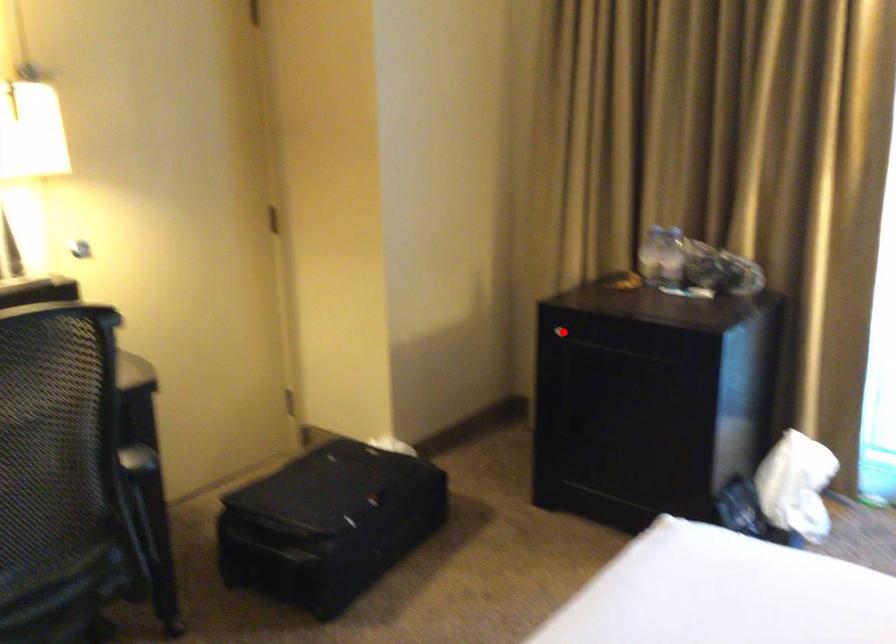
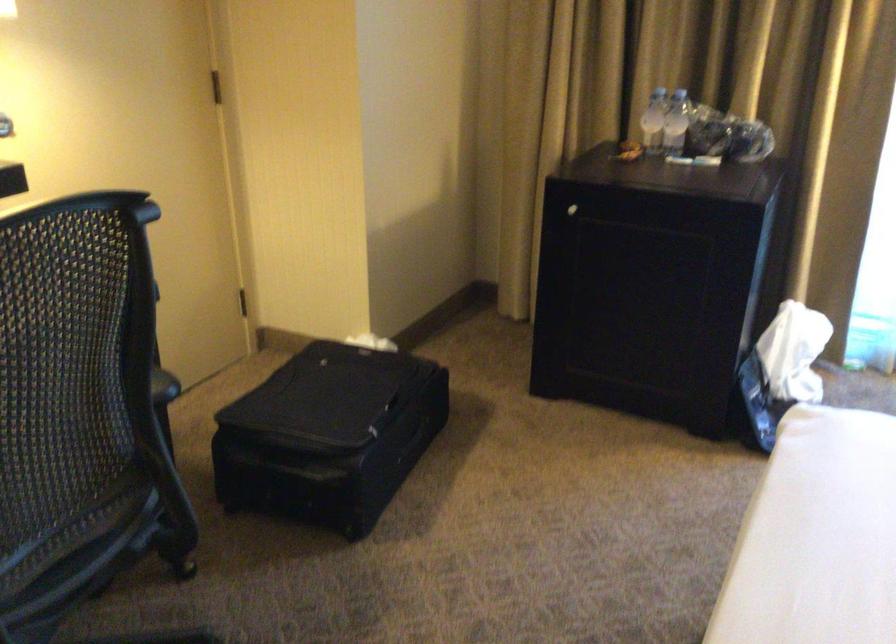
Where in the second image is the point corresponding to the highlighted location from the first image?

(572, 210)